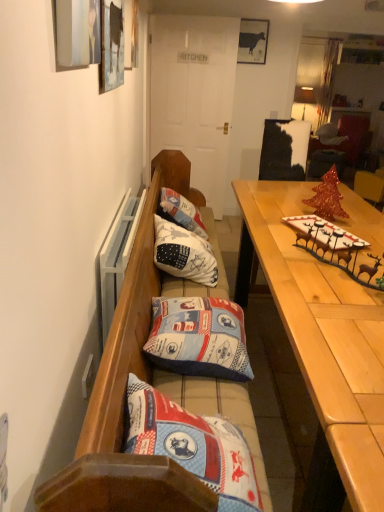
Where is `free space above light wood table at right (from a real-world perspective)`? free space above light wood table at right (from a real-world perspective) is located at coordinates (307, 222).